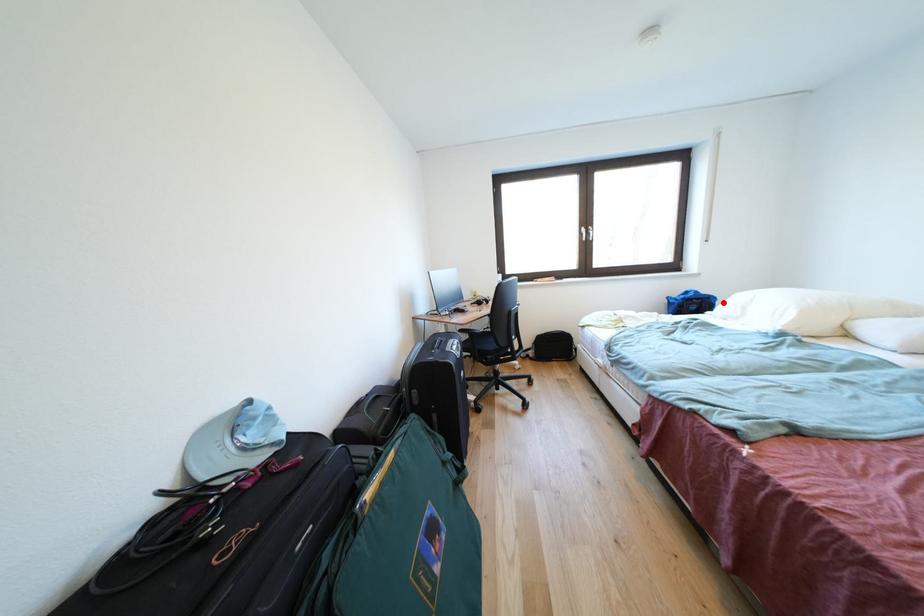
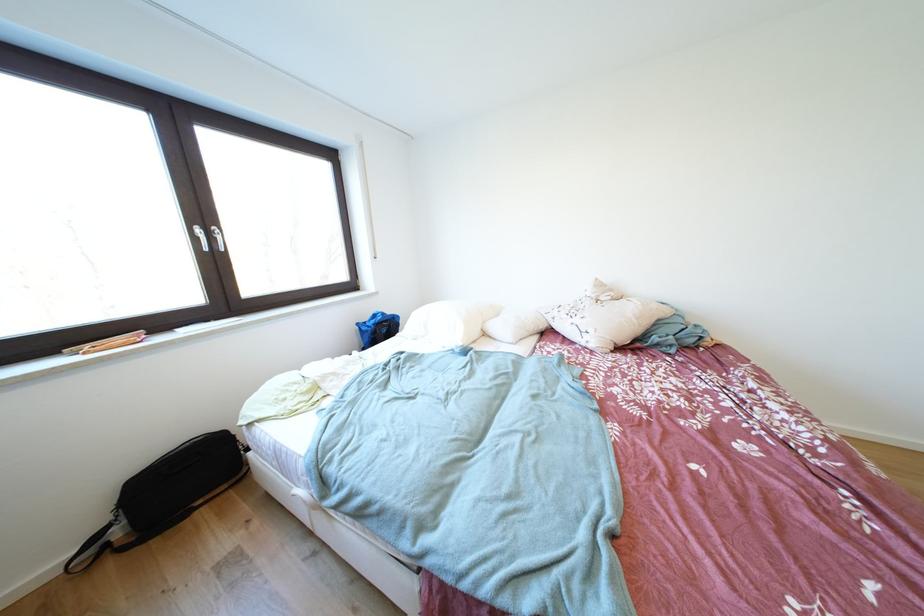
Find the pixel in the second image that matches the highlighted location in the first image.

(407, 321)